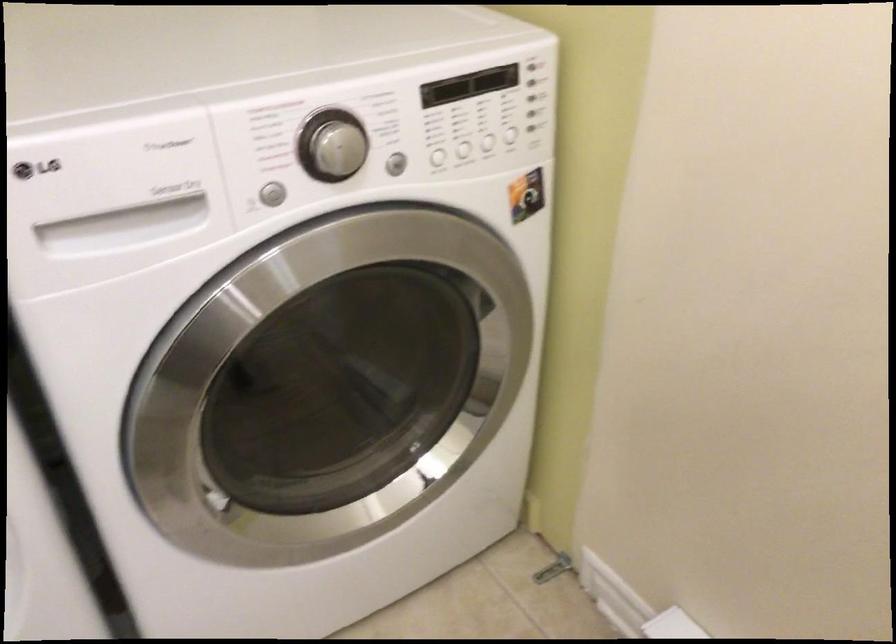
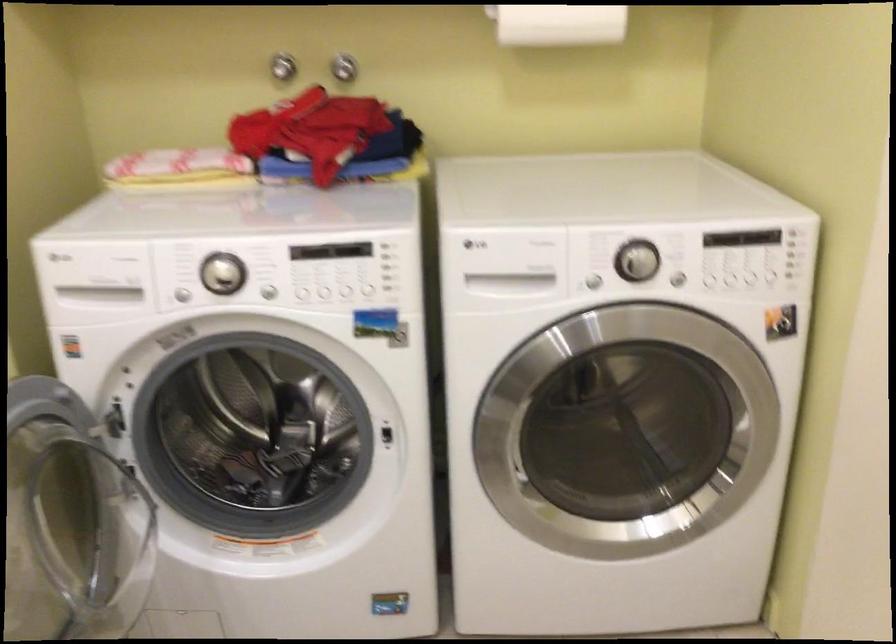
Question: How did the camera likely rotate?

Choices:
 (A) Left
 (B) Right
 (C) Up
 (D) Down

Answer: (A)